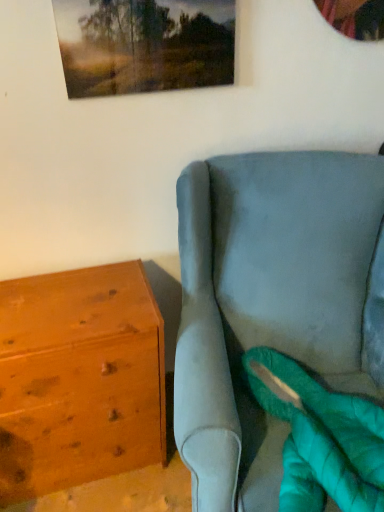
What do you see at coordinates (144, 45) in the screenshot? I see `matte wooden picture frame at upper center` at bounding box center [144, 45].

In order to click on matte wooden picture frame at upper center in this screenshot , I will do `click(144, 45)`.

Image resolution: width=384 pixels, height=512 pixels. I want to click on wooden chest of drawers at left, so click(x=79, y=379).

Describe the element at coordinates (79, 379) in the screenshot. This screenshot has height=512, width=384. I see `wooden chest of drawers at left` at that location.

Locate an element on the screen. This screenshot has width=384, height=512. matte wooden picture frame at upper center is located at coordinates (144, 45).

Which is more to the left, wooden chest of drawers at left or matte wooden picture frame at upper center?

Positioned to the left is wooden chest of drawers at left.

Does wooden chest of drawers at left lie behind matte wooden picture frame at upper center?

Yes.

Which is nearer, (77, 282) or (209, 21)?

Point (77, 282).

From the image's perspective, would you say wooden chest of drawers at left is positioned over matte wooden picture frame at upper center?

No, from the image's perspective, wooden chest of drawers at left is not on top of matte wooden picture frame at upper center.

From a real-world perspective, does wooden chest of drawers at left stand above matte wooden picture frame at upper center?

No, from a real-world perspective, wooden chest of drawers at left is not on top of matte wooden picture frame at upper center.

Is wooden chest of drawers at left wider or thinner than matte wooden picture frame at upper center?

In the image, wooden chest of drawers at left appears to be wider than matte wooden picture frame at upper center.

Can you confirm if wooden chest of drawers at left is shorter than matte wooden picture frame at upper center?

No, wooden chest of drawers at left is not shorter than matte wooden picture frame at upper center.

Between wooden chest of drawers at left and matte wooden picture frame at upper center, which one has smaller size?

matte wooden picture frame at upper center.

Consider the image. Is wooden chest of drawers at left inside or outside of matte wooden picture frame at upper center?

wooden chest of drawers at left cannot be found inside matte wooden picture frame at upper center.

Is wooden chest of drawers at left positioned far away from matte wooden picture frame at upper center?

No, wooden chest of drawers at left is not far from matte wooden picture frame at upper center.

Is wooden chest of drawers at left facing towards matte wooden picture frame at upper center?

No, wooden chest of drawers at left is not turned towards matte wooden picture frame at upper center.

Image resolution: width=384 pixels, height=512 pixels. What are the coordinates of `picture frame on the right of wooden chest of drawers at left` in the screenshot? It's located at (144, 45).

Would you say matte wooden picture frame at upper center is to the left or to the right of wooden chest of drawers at left in the picture?

Clearly, matte wooden picture frame at upper center is on the right of wooden chest of drawers at left in the image.

Considering the positions of objects matte wooden picture frame at upper center and wooden chest of drawers at left in the image provided, who is behind, matte wooden picture frame at upper center or wooden chest of drawers at left?

wooden chest of drawers at left.

Is point (120, 87) farther from viewer compared to point (46, 329)?

Yes, it is.

From the image's perspective, is matte wooden picture frame at upper center below wooden chest of drawers at left?

Incorrect, from the image's perspective, matte wooden picture frame at upper center is higher than wooden chest of drawers at left.

From the picture: From a real-world perspective, is matte wooden picture frame at upper center physically located above or below wooden chest of drawers at left?

matte wooden picture frame at upper center is situated higher than wooden chest of drawers at left in the real world.

Consider the image. Is matte wooden picture frame at upper center thinner than wooden chest of drawers at left?

Indeed, matte wooden picture frame at upper center has a lesser width compared to wooden chest of drawers at left.

From the picture: Considering the sizes of objects matte wooden picture frame at upper center and wooden chest of drawers at left in the image provided, who is taller, matte wooden picture frame at upper center or wooden chest of drawers at left?

With more height is wooden chest of drawers at left.

Between matte wooden picture frame at upper center and wooden chest of drawers at left, which one has larger size?

wooden chest of drawers at left.

Is matte wooden picture frame at upper center completely or partially outside of wooden chest of drawers at left?

That's correct, matte wooden picture frame at upper center is outside of wooden chest of drawers at left.

Are matte wooden picture frame at upper center and wooden chest of drawers at left located far from each other?

They are positioned close to each other.

Is matte wooden picture frame at upper center facing towards wooden chest of drawers at left?

No, matte wooden picture frame at upper center does not turn towards wooden chest of drawers at left.

Can you tell me how much matte wooden picture frame at upper center and wooden chest of drawers at left differ in facing direction?

0.3 degrees separate the facing orientations of matte wooden picture frame at upper center and wooden chest of drawers at left.

Measure the distance between matte wooden picture frame at upper center and wooden chest of drawers at left.

The distance of matte wooden picture frame at upper center from wooden chest of drawers at left is 29.61 inches.

The height and width of the screenshot is (512, 384). What are the coordinates of `chest of drawers below the matte wooden picture frame at upper center (from the image's perspective)` in the screenshot? It's located at (79, 379).

Locate an element on the screen. The width and height of the screenshot is (384, 512). chest of drawers behind the matte wooden picture frame at upper center is located at coordinates (79, 379).

This screenshot has height=512, width=384. I want to click on picture frame on the right side of wooden chest of drawers at left, so click(144, 45).